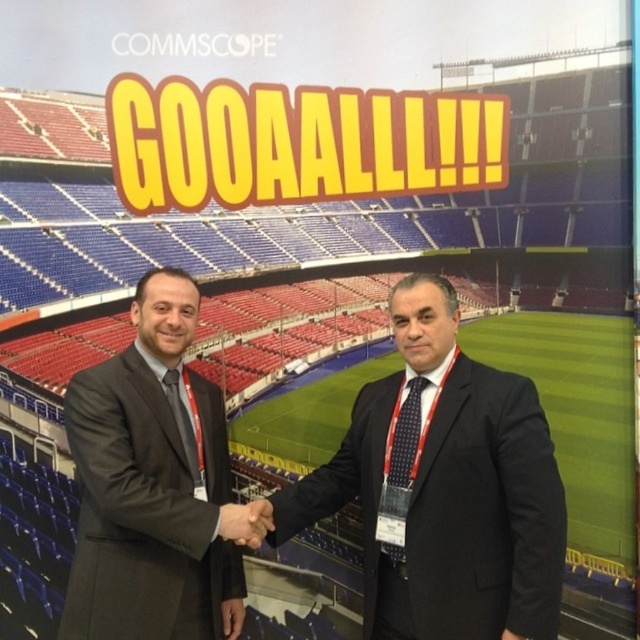
Does dark suit at center appear over dark gray suit at center?

Actually, dark suit at center is below dark gray suit at center.

This screenshot has width=640, height=640. I want to click on dark suit at center, so click(445, 486).

Which is in front, point (177, 292) or point (262, 502)?

Point (262, 502) is in front.

Looking at this image, which of these two, dark gray suit at center or smooth skin handshake at center, stands shorter?

smooth skin handshake at center

The width and height of the screenshot is (640, 640). I want to click on dark gray suit at center, so click(x=150, y=484).

Does dark suit at center appear under smooth skin handshake at center?

No.

Is point (456, 561) positioned in front of point (240, 524)?

That is True.

In order to click on dark suit at center in this screenshot , I will do `click(445, 486)`.